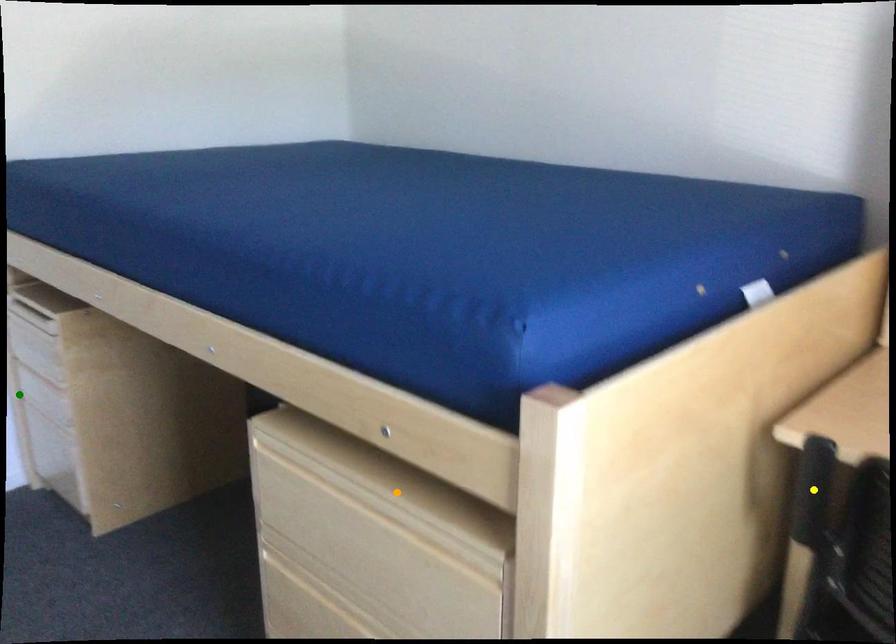
Order these from nearest to farthest:
1. orange point
2. yellow point
3. green point

yellow point < orange point < green point